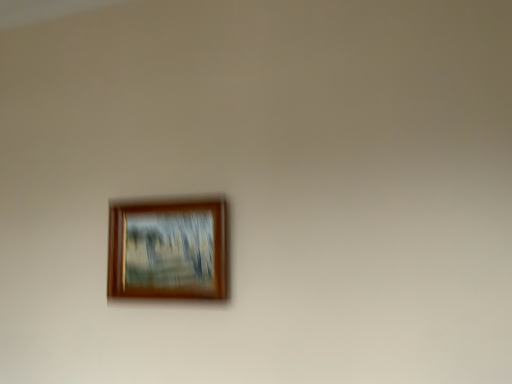
I want to click on wooden frame at center, so click(x=168, y=249).

This screenshot has width=512, height=384. Describe the element at coordinates (168, 249) in the screenshot. I see `wooden frame at center` at that location.

In order to face wooden frame at center, should I rotate leftwards or rightwards?

Turn left by 12.516 degrees to look at wooden frame at center.

You are a GUI agent. You are given a task and a screenshot of the screen. Output one action in this format:
    pyautogui.click(x=<x>, y=<y>)
    Task: Click on the wooden frame at center
    The height and width of the screenshot is (384, 512).
    Given the screenshot: What is the action you would take?
    pyautogui.click(x=168, y=249)